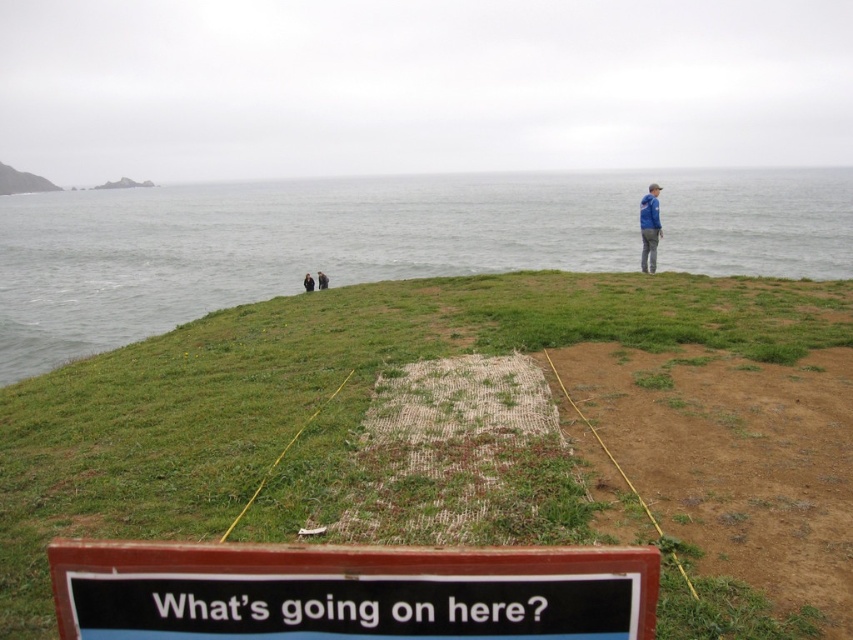
You are a hiker who just arrived at the coastal area and see the black plastic sign at lower center and the blue fabric jacket at upper right. Which object is positioned lower in the image?

The black plastic sign at lower center is positioned below the blue fabric jacket at upper right, so the black plastic sign at lower center is lower in the image.

Looking at this image, you are standing at the position of the black fabric person at lower left and want to throw a ball to the blue fabric jacket at upper right. What is the approximate distance you need to throw the ball?

The blue fabric jacket at upper right is 8.65 meters from the black fabric person at lower left, so you need to throw the ball approximately 8.65 meters to reach it.